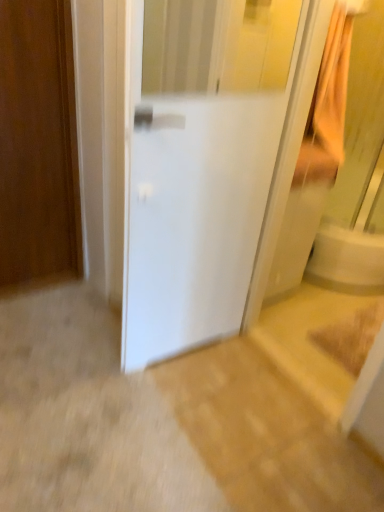
Question: Considering the relative positions of white matte refrigerator at center, the second door positioned from the left, and wooden door at left, the second door when ordered from right to left, in the image provided, is white matte refrigerator at center, the second door positioned from the left, to the left or to the right of wooden door at left, the second door when ordered from right to left,?

Choices:
 (A) left
 (B) right

Answer: (B)

Question: Is white matte refrigerator at center, the second door positioned from the left, inside the boundaries of wooden door at left, the second door when ordered from right to left, or outside?

Choices:
 (A) outside
 (B) inside

Answer: (A)

Question: Is point (148, 186) closer or farther from the camera than point (54, 16)?

Choices:
 (A) farther
 (B) closer

Answer: (B)

Question: From their relative heights in the image, would you say wooden door at left, acting as the first door starting from the left, is taller or shorter than white matte refrigerator at center, the 1th door viewed from the right?

Choices:
 (A) tall
 (B) short

Answer: (B)

Question: Considering the positions of wooden door at left, the second door when ordered from right to left, and white matte refrigerator at center, the second door positioned from the left, in the image, is wooden door at left, the second door when ordered from right to left, wider or thinner than white matte refrigerator at center, the second door positioned from the left,?

Choices:
 (A) thin
 (B) wide

Answer: (A)

Question: Visually, is wooden door at left, the second door when ordered from right to left, positioned to the left or to the right of white matte refrigerator at center, the second door positioned from the left?

Choices:
 (A) right
 (B) left

Answer: (B)

Question: Relative to white matte refrigerator at center, the 1th door viewed from the right, is wooden door at left, acting as the first door starting from the left, in front or behind?

Choices:
 (A) front
 (B) behind

Answer: (B)